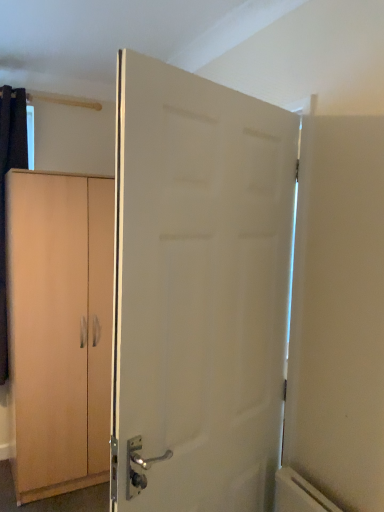
Question: Is white matte door at center inside the boundaries of light wood cabinet at left, or outside?

Choices:
 (A) inside
 (B) outside

Answer: (B)

Question: In the image, is white matte door at center on the left side or the right side of light wood cabinet at left?

Choices:
 (A) left
 (B) right

Answer: (B)

Question: From a real-world perspective, is white matte door at center positioned above or below light wood cabinet at left?

Choices:
 (A) below
 (B) above

Answer: (B)

Question: Looking at their shapes, would you say light wood cabinet at left is wider or thinner than white matte door at center?

Choices:
 (A) wide
 (B) thin

Answer: (A)

Question: Considering the positions of light wood cabinet at left and white matte door at center in the image, is light wood cabinet at left taller or shorter than white matte door at center?

Choices:
 (A) short
 (B) tall

Answer: (B)

Question: Is light wood cabinet at left spatially inside white matte door at center, or outside of it?

Choices:
 (A) outside
 (B) inside

Answer: (A)

Question: Based on their positions, is light wood cabinet at left located to the left or right of white matte door at center?

Choices:
 (A) right
 (B) left

Answer: (B)